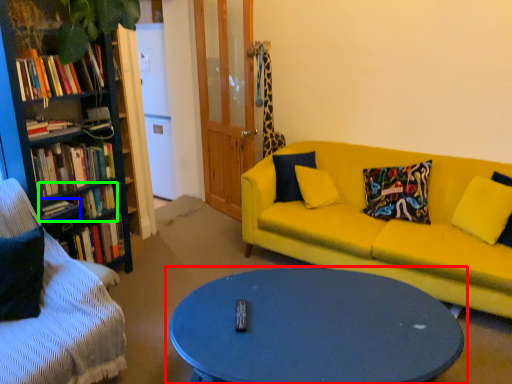
Question: Estimate the real-world distances between objects in this image. Which object is farther from coffee table (highlighted by a red box), book (highlighted by a blue box) or book (highlighted by a green box)?

Choices:
 (A) book
 (B) book

Answer: (A)